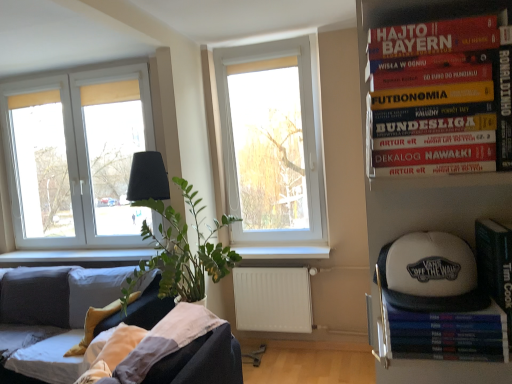
Question: From the image's perspective, is white fabric baseball cap at right located above or below white plastic window at center, which ranks as the 1th window in right-to-left order?

Choices:
 (A) below
 (B) above

Answer: (A)

Question: Is point (389, 271) closer or farther from the camera than point (304, 187)?

Choices:
 (A) farther
 (B) closer

Answer: (B)

Question: Estimate the real-world distances between objects in this image. Which object is farther from the white fabric baseball cap at right?

Choices:
 (A) white plastic window at left, which is counted as the second window, starting from the right
 (B) white wood window sill at center
 (C) hardcover book at upper right
 (D) white plastic window at center, the 1th window from the front
 (E) green matte paperback book at right, acting as the second paperback book starting from the left

Answer: (A)

Question: Which is nearer to the hardcover book at upper right?

Choices:
 (A) white plastic window at left, the 2th window in the front-to-back sequence
 (B) green matte paperback book at right, the 1th paperback book positioned from the right
 (C) white plastic window at center, the 1th window from the front
 (D) velvet dark grey couch at lower left
 (E) white matte radiator at lower center

Answer: (B)